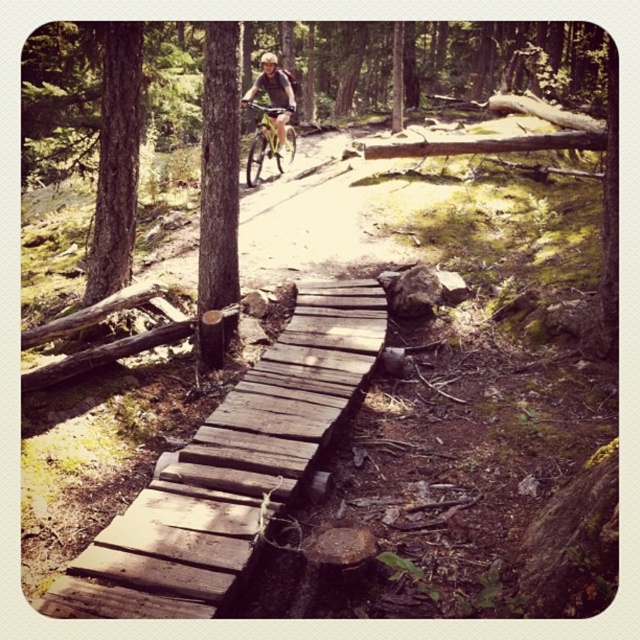
Question: Among these objects, which one is nearest to the camera?

Choices:
 (A) matte black helmet at upper center
 (B) weathered wooden bridge at center

Answer: (B)

Question: Which point is closer to the camera?

Choices:
 (A) (268, 106)
 (B) (276, 65)
 (C) (342, 296)

Answer: (C)

Question: Does matte black helmet at upper center come behind yellow-green metallic bicycle at center?

Choices:
 (A) no
 (B) yes

Answer: (B)

Question: Can you confirm if yellow-green metallic bicycle at center is smaller than white matte helmet at upper center?

Choices:
 (A) yes
 (B) no

Answer: (A)

Question: In this image, where is weathered wooden bridge at center located relative to matte black helmet at upper center?

Choices:
 (A) right
 (B) left

Answer: (A)

Question: Which of the following is the closest to the observer?

Choices:
 (A) (134, 516)
 (B) (269, 109)
 (C) (276, 144)

Answer: (A)